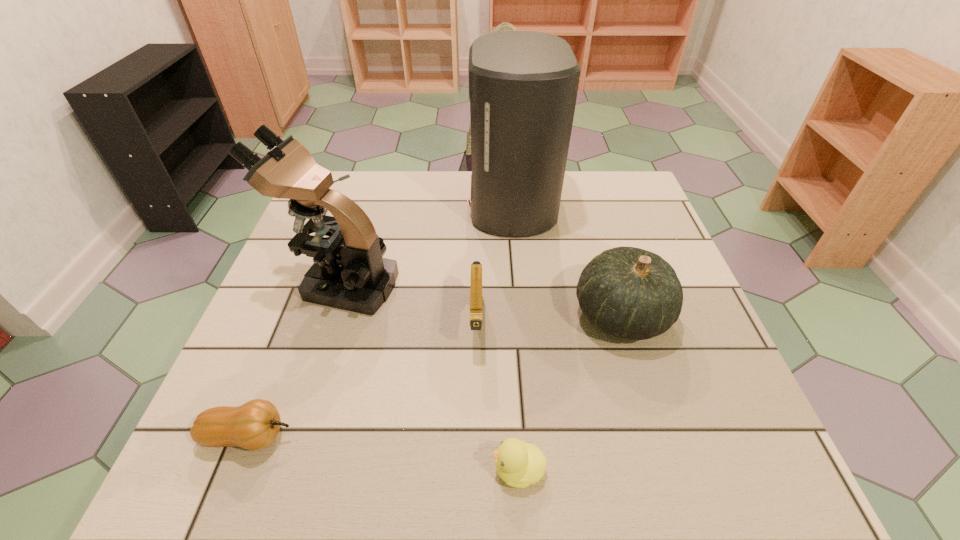
Locate an element on the screen. The image size is (960, 540). free spot between the farthest object and the duckling is located at coordinates (516, 337).

Select which object appears as the fifth closest to the farthest object. Please provide its 2D coordinates. Your answer should be formatted as a tuple, i.e. [(x, y)], where the tuple contains the x and y coordinates of a point satisfying the conditions above.

[(254, 425)]

Identify which object is located as the fourth nearest to the duckling. Please provide its 2D coordinates. Your answer should be formatted as a tuple, i.e. [(x, y)], where the tuple contains the x and y coordinates of a point satisfying the conditions above.

[(349, 273)]

At what (x,y) coordinates should I click in order to perform the action: click on free space in the image that satisfies the following two spatial constraints: 1. on the button side of the farthest object; 2. on the left side of the farther gourd. Please return your answer as a coordinate pair (x, y). This screenshot has width=960, height=540. Looking at the image, I should click on (521, 315).

In order to click on vacant space that satisfies the following two spatial constraints: 1. at the barrel of the third shortest object; 2. on the stem side of the left gourd in this screenshot , I will do `click(476, 436)`.